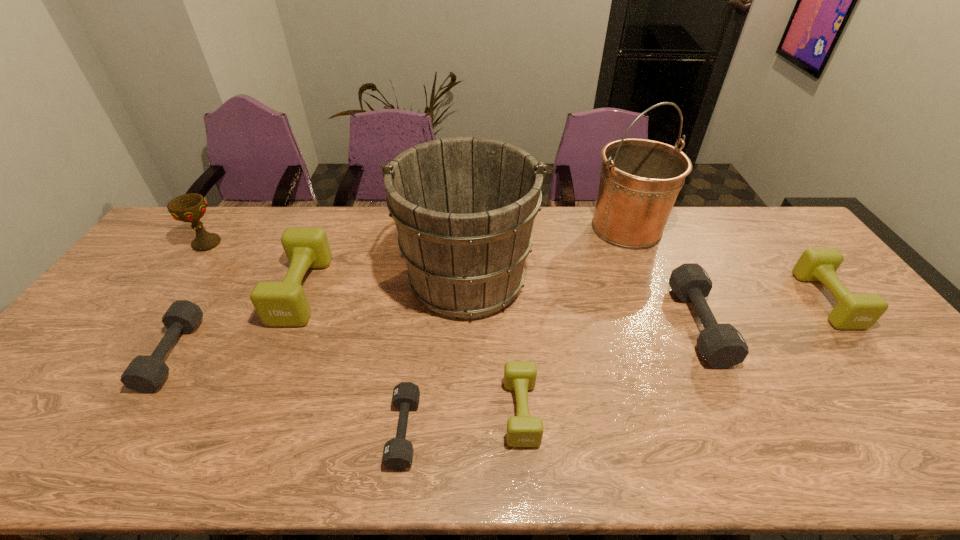
This screenshot has height=540, width=960. I want to click on free location at the left edge of the desktop, so click(x=138, y=276).

At what (x,y) coordinates should I click in order to perform the action: click on vacant space at the right edge of the desktop. Please return your answer as a coordinate pair (x, y). This screenshot has width=960, height=540. Looking at the image, I should click on (828, 341).

At what (x,y) coordinates should I click in order to perform the action: click on vacant space at the far left corner. Please return your answer as a coordinate pair (x, y). This screenshot has width=960, height=540. Looking at the image, I should click on (181, 234).

Where is `free spot between the leftmost dumbbell and the second smallest olive dumbbell`? This screenshot has width=960, height=540. free spot between the leftmost dumbbell and the second smallest olive dumbbell is located at coordinates (499, 327).

Locate an element on the screen. unoccupied position between the tallest dumbbell and the eighth object from right to left is located at coordinates (237, 322).

Locate an element on the screen. The height and width of the screenshot is (540, 960). free spot between the nearest olive dumbbell and the rightmost object is located at coordinates (674, 356).

Where is `free space between the shortest object and the right bucket`? The height and width of the screenshot is (540, 960). free space between the shortest object and the right bucket is located at coordinates (516, 329).

The image size is (960, 540). What are the coordinates of `free space between the rightmost olive dumbbell and the right bucket` in the screenshot? It's located at (727, 264).

At what (x,y) coordinates should I click in order to perform the action: click on empty space that is in between the seventh object from right to left and the third tallest object. Please return your answer as a coordinate pair (x, y). This screenshot has width=960, height=540. Looking at the image, I should click on (254, 267).

Where is `vacant space that's between the right bucket and the shortest dumbbell`? This screenshot has width=960, height=540. vacant space that's between the right bucket and the shortest dumbbell is located at coordinates (516, 329).